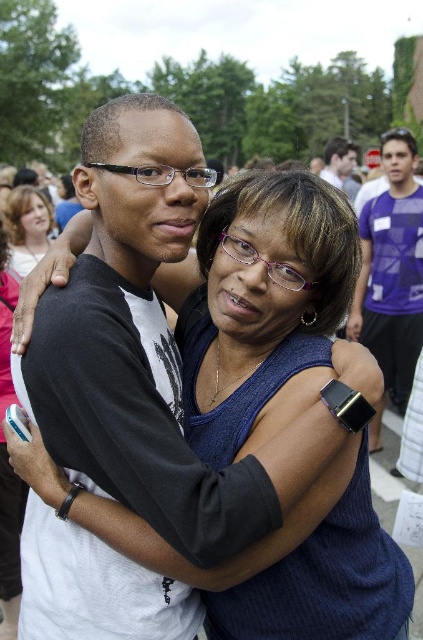
Question: Does purple fabric shirt at right have a smaller size compared to matte black hair at upper left?

Choices:
 (A) yes
 (B) no

Answer: (B)

Question: Which is nearer to the matte black watch at upper right?

Choices:
 (A) matte black hair at upper left
 (B) purple fabric shirt at right

Answer: (B)

Question: Estimate the real-world distances between objects in this image. Which object is farther from the matte black hair at upper left?

Choices:
 (A) purple fabric shirt at right
 (B) matte black watch at upper right

Answer: (B)

Question: Which point is farther to the camera?

Choices:
 (A) matte black hair at upper left
 (B) matte black watch at upper right
 (C) purple fabric shirt at right

Answer: (B)

Question: Is purple fabric shirt at right bigger than matte black watch at upper right?

Choices:
 (A) no
 (B) yes

Answer: (A)

Question: Can you confirm if matte black hair at upper left is bigger than matte black watch at upper right?

Choices:
 (A) yes
 (B) no

Answer: (B)